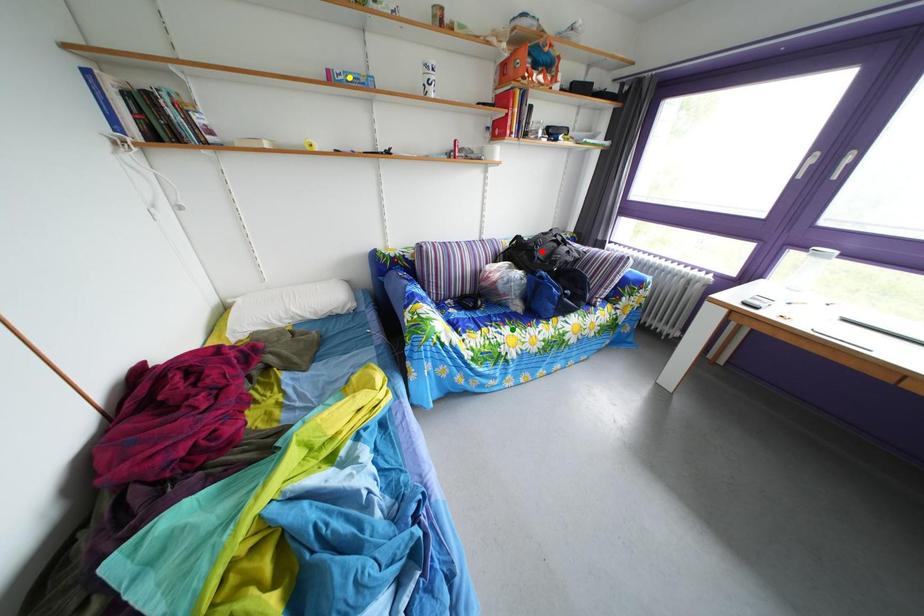
Order these from nearest to farthest:
yellow point
green point
red point

yellow point, green point, red point